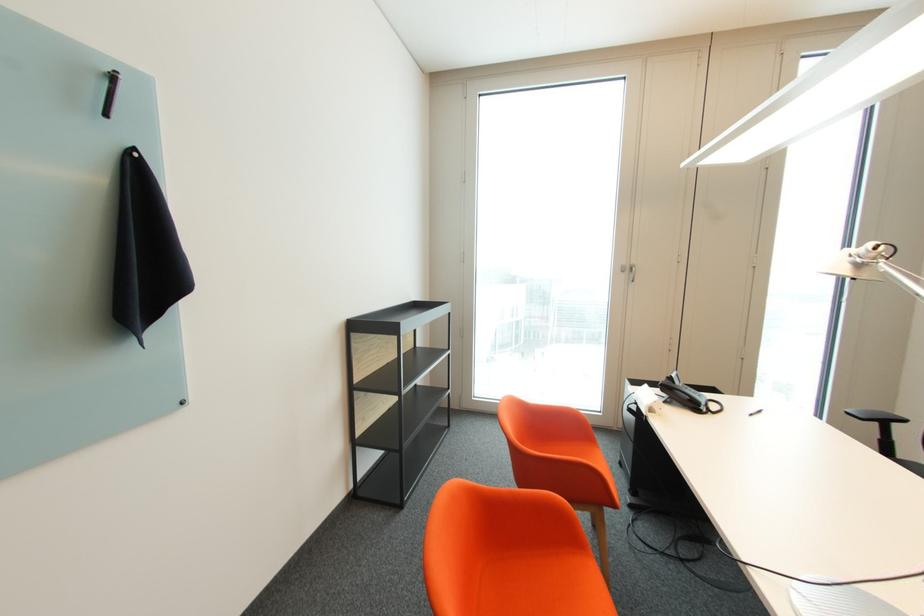
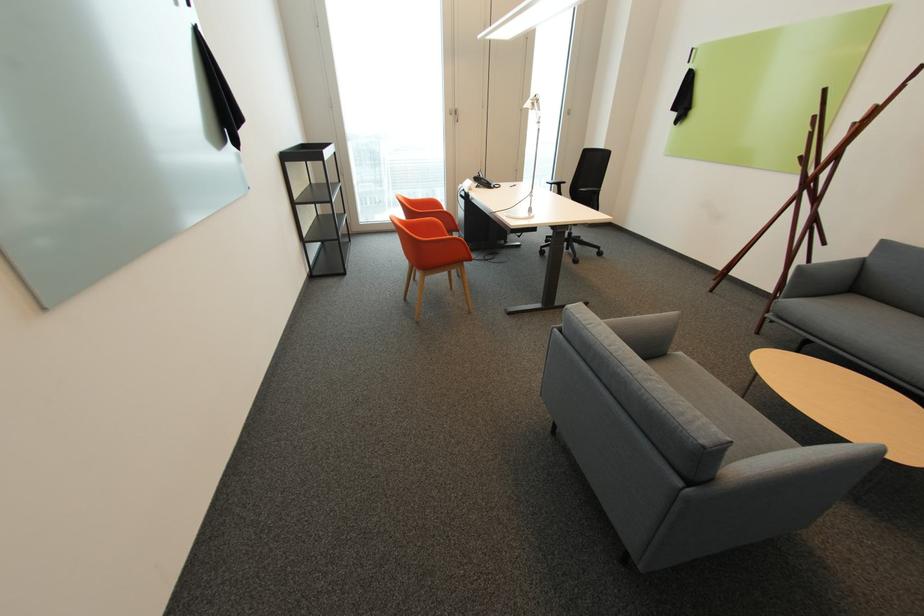
In the second image, find the point that corresponds to point 857,411 in the first image.

(553, 182)